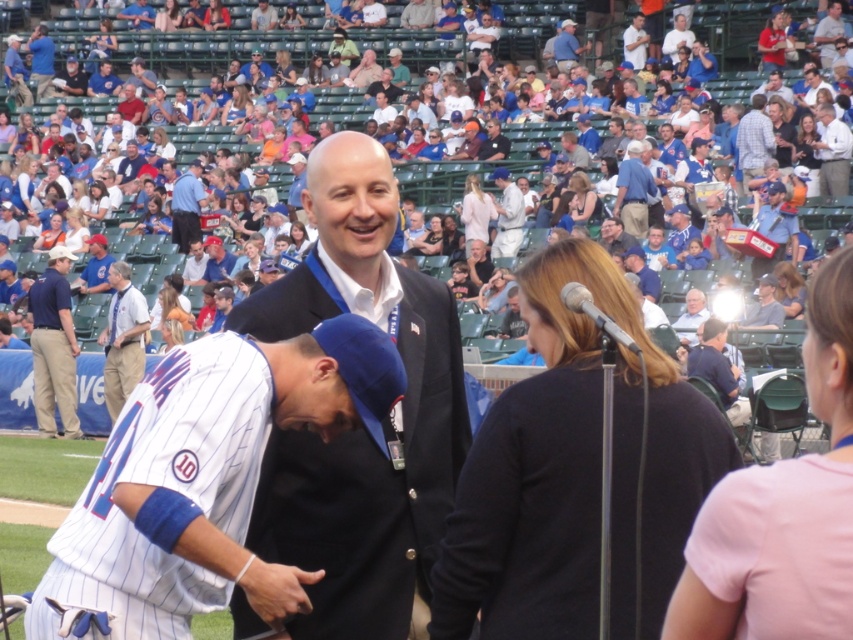
Is blue fabric jacket at upper right smaller than light blue shirt at upper right?

Correct, blue fabric jacket at upper right occupies less space than light blue shirt at upper right.

Where is `blue fabric jacket at upper right`? The width and height of the screenshot is (853, 640). blue fabric jacket at upper right is located at coordinates (633, 192).

I want to click on blue fabric jacket at upper right, so click(x=633, y=192).

Can you confirm if white pinstriped jersey at upper center is positioned to the left of gray fabric jacket at upper right?

Yes, white pinstriped jersey at upper center is to the left of gray fabric jacket at upper right.

Is white pinstriped jersey at upper center closer to the viewer compared to gray fabric jacket at upper right?

No, white pinstriped jersey at upper center is further to the viewer.

Between point (521, 234) and point (780, 324), which one is positioned behind?

The point (521, 234) is behind.

In order to click on white pinstriped jersey at upper center in this screenshot , I will do point(508,216).

Does blue fabric shirt at upper left appear on the right side of gray fabric jacket at upper right?

No, blue fabric shirt at upper left is not to the right of gray fabric jacket at upper right.

Between point (183, 209) and point (751, 326), which one is positioned behind?

The point (183, 209) is more distant.

Is point (194, 196) more distant than point (776, 316)?

That is True.

Where is `blue fabric shirt at upper left`? This screenshot has width=853, height=640. blue fabric shirt at upper left is located at coordinates (187, 205).